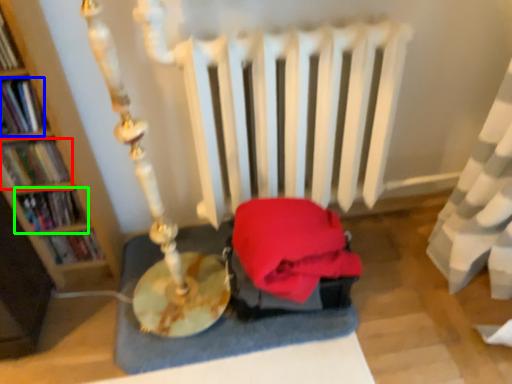
Question: Which object is positioned closest to book (highlighted by a red box)? Select from book (highlighted by a blue box) and book (highlighted by a green box).

Choices:
 (A) book
 (B) book

Answer: (B)